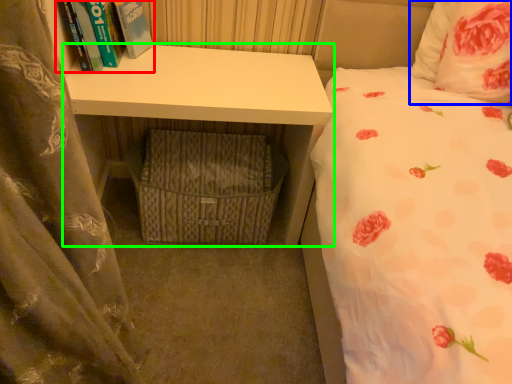
Question: Based on their relative distances, which object is farther from book (highlighted by a red box)? Choose from pillow (highlighted by a blue box) and desk (highlighted by a green box).

Choices:
 (A) pillow
 (B) desk

Answer: (A)